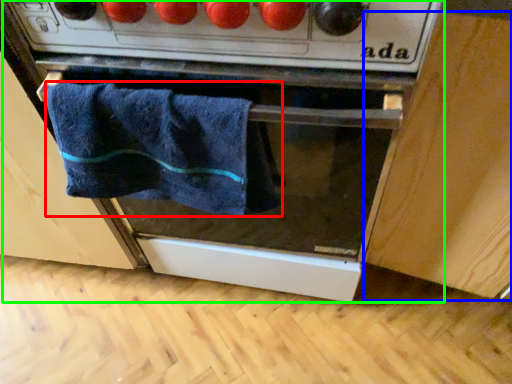
Question: Based on their relative distances, which object is nearer to towel (highlighted by a red box)? Choose from cabinetry (highlighted by a blue box) and oven (highlighted by a green box).

Choices:
 (A) cabinetry
 (B) oven

Answer: (B)